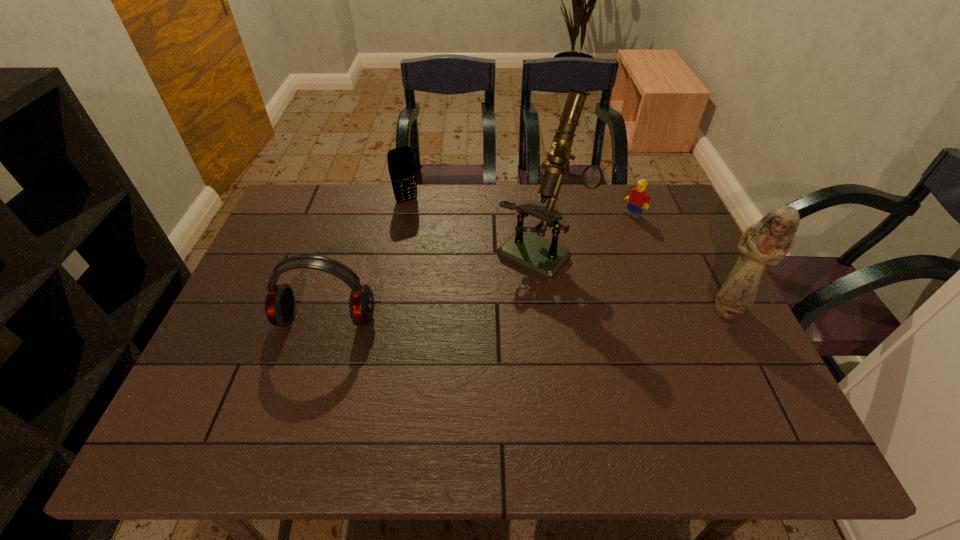
This screenshot has height=540, width=960. I want to click on vacant space situated on the screen of the cellular telephone, so click(x=446, y=267).

Identify the location of free location located on the screen of the cellular telephone. The width and height of the screenshot is (960, 540). (428, 235).

Image resolution: width=960 pixels, height=540 pixels. Identify the location of vacant space positioned 0.080m on the screen of the cellular telephone. (420, 220).

Where is `free space located 0.240m on the front-facing side of the fourth object from left to right`? The height and width of the screenshot is (540, 960). free space located 0.240m on the front-facing side of the fourth object from left to right is located at coordinates (584, 257).

Locate an element on the screen. free space located 0.120m on the front-facing side of the fourth object from left to right is located at coordinates (607, 237).

You are a GUI agent. You are given a task and a screenshot of the screen. Output one action in this format:
    pyautogui.click(x=<x>, y=<y>)
    Task: Click on the vacant area situated 0.240m on the front-facing side of the fourth object from left to right
    
    Given the screenshot: What is the action you would take?
    pyautogui.click(x=584, y=257)

Identify the location of vacant point located 0.130m at the eyepiece of the tallest object. (489, 305).

What are the coordinates of `vacant region located at the eyepiece of the tallest object` in the screenshot? It's located at (469, 325).

Where is `vacant space located 0.140m at the eyepiece of the tallest object`? This screenshot has height=540, width=960. vacant space located 0.140m at the eyepiece of the tallest object is located at coordinates (486, 307).

The width and height of the screenshot is (960, 540). I want to click on cellular telephone positioned at the far edge, so click(401, 163).